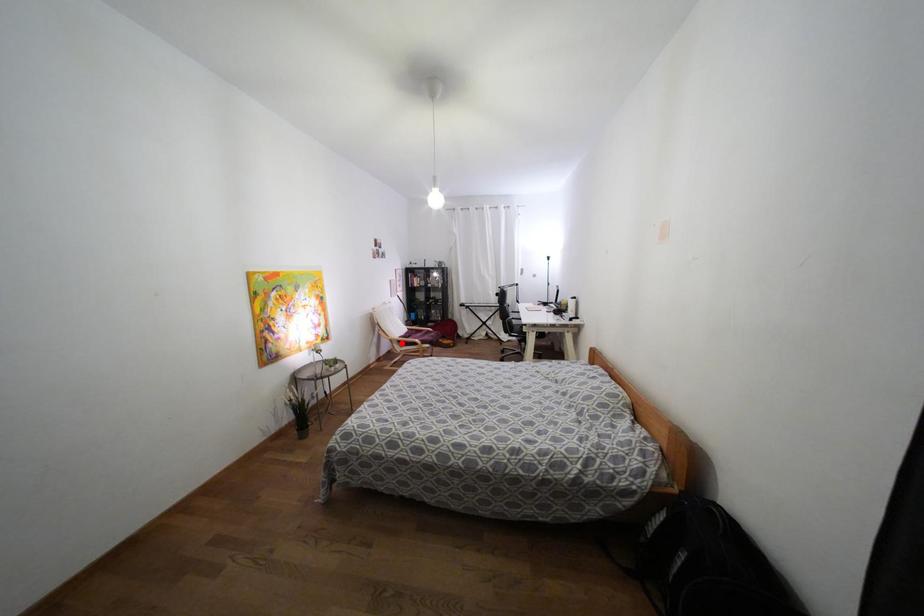
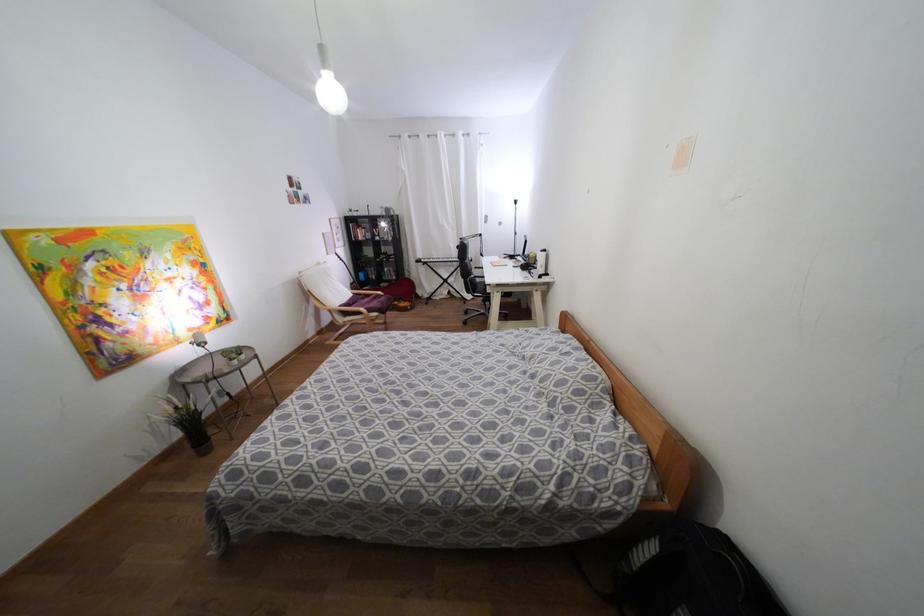
In the second image, find the point that corresponds to the highlighted location in the first image.

(344, 313)